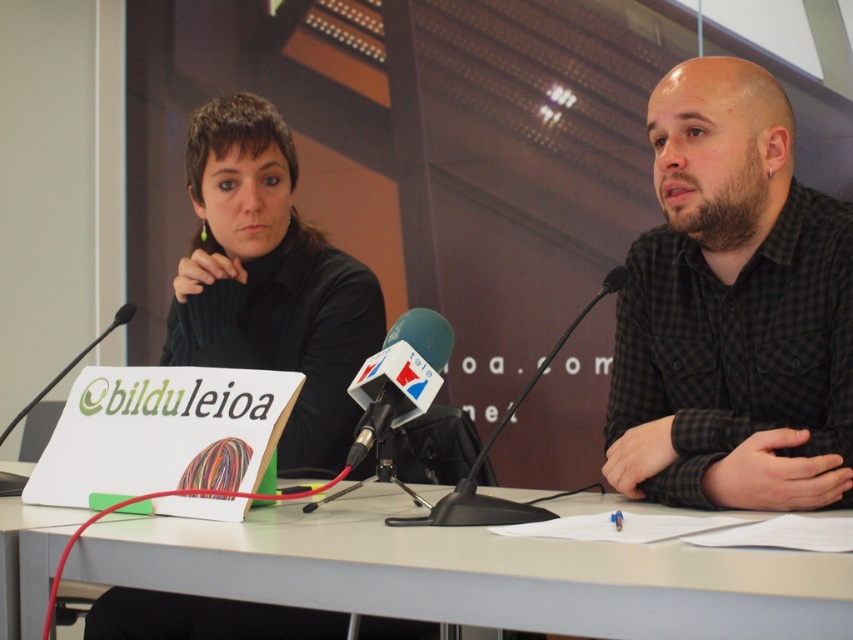
Between black matte sweater at left and black plastic microphone at center, which one appears on the left side from the viewer's perspective?

From the viewer's perspective, black matte sweater at left appears more on the left side.

Does black matte sweater at left have a smaller size compared to black plastic microphone at center?

Actually, black matte sweater at left might be larger than black plastic microphone at center.

Locate an element on the screen. black matte sweater at left is located at coordinates (270, 280).

Is white plastic table at center closer to camera compared to matte black microphone at center?

Yes, white plastic table at center is in front of matte black microphone at center.

Is white plastic table at center to the left of matte black microphone at center from the viewer's perspective?

Indeed, white plastic table at center is positioned on the left side of matte black microphone at center.

The height and width of the screenshot is (640, 853). Describe the element at coordinates (474, 573) in the screenshot. I see `white plastic table at center` at that location.

The image size is (853, 640). What are the coordinates of `white plastic table at center` in the screenshot? It's located at [474, 573].

Measure the distance between black plastic microphone at center and black plastic microphone at left.

black plastic microphone at center is 62.09 centimeters away from black plastic microphone at left.

Is point (351, 448) in front of point (109, 330)?

Yes, it is in front of point (109, 330).

Is point (387, 352) less distant than point (1, 433)?

Yes, point (387, 352) is closer to viewer.

The height and width of the screenshot is (640, 853). Identify the location of black plastic microphone at center. click(x=399, y=378).